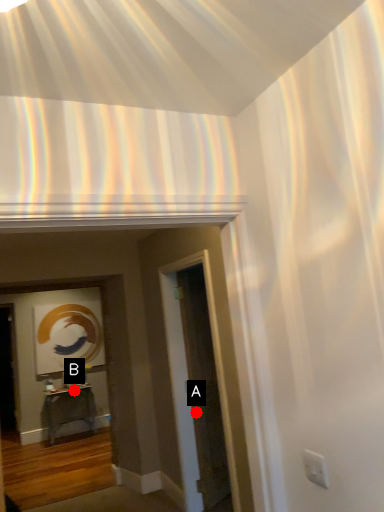
Question: Two points are circled on the image, labeled by A and B beside each circle. Which of the following is the closest to the observer?

Choices:
 (A) A is closer
 (B) B is closer

Answer: (A)